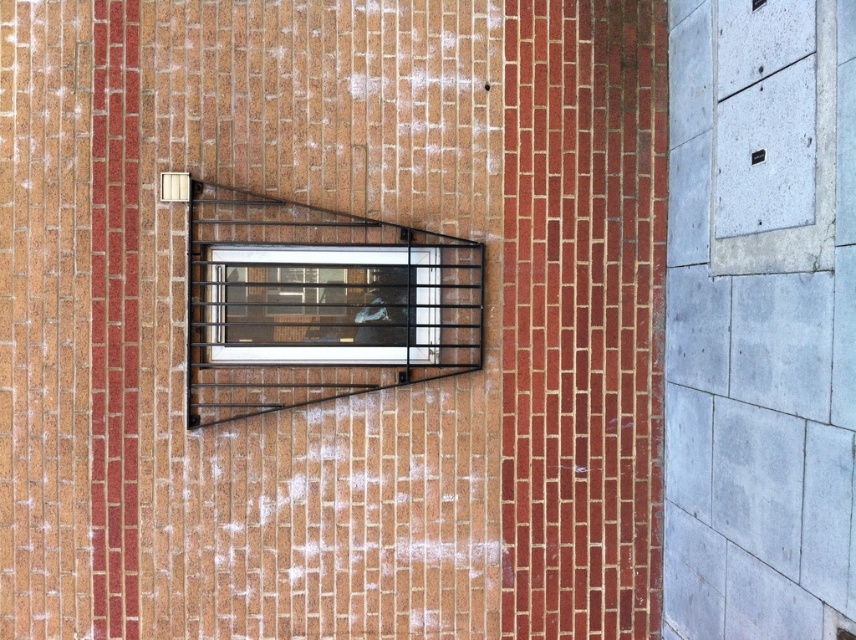
Is black metal fire escape at center positioned in front of clear glass window at center?

Yes, it is.

Can you confirm if black metal fire escape at center is positioned to the left of clear glass window at center?

No, black metal fire escape at center is not to the left of clear glass window at center.

Does point (455, 355) come closer to viewer compared to point (393, 275)?

Yes, it is in front of point (393, 275).

Locate an element on the screen. The height and width of the screenshot is (640, 856). black metal fire escape at center is located at coordinates (318, 305).